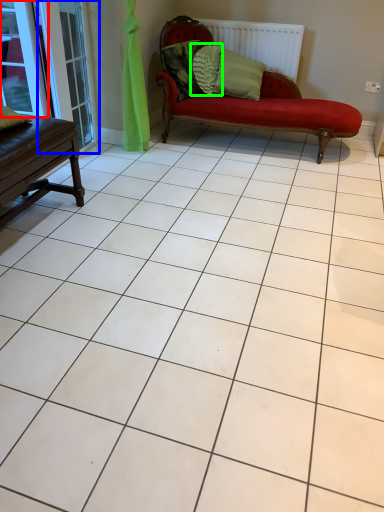
Question: Which object is the closest to the window (highlighted by a red box)? Choose among these: screen door (highlighted by a blue box) or pillow (highlighted by a green box).

Choices:
 (A) screen door
 (B) pillow

Answer: (A)